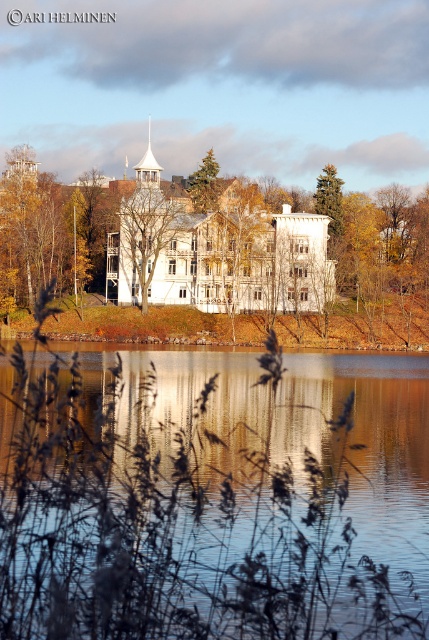
Question: Among these points, which one is nearest to the camera?

Choices:
 (A) (65, 381)
 (B) (323, 208)
 (C) (147, 150)

Answer: (A)

Question: Can you confirm if brown textured tree at center is bigger than green matte tree at upper center?

Choices:
 (A) yes
 (B) no

Answer: (A)

Question: Is transparent water at center below white steeple at upper center?

Choices:
 (A) yes
 (B) no

Answer: (A)

Question: Which object is positioned closest to the yellow autumn leaves at center?

Choices:
 (A) transparent water at center
 (B) yellow/golden leaves at center

Answer: (B)

Question: Is yellow autumn leaves at center wider than green matte tree at upper center?

Choices:
 (A) yes
 (B) no

Answer: (A)

Question: Which point is closer to the camera?

Choices:
 (A) yellow autumn leaves at center
 (B) white steeple at upper center
 (C) transparent water at center

Answer: (C)